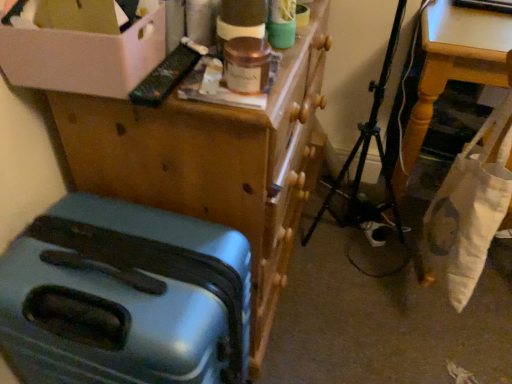
Question: Visually, is white fabric bag at lower right positioned to the left or to the right of metallic blue suitcase at lower left?

Choices:
 (A) right
 (B) left

Answer: (A)

Question: Considering the positions of white fabric bag at lower right and metallic blue suitcase at lower left in the image, is white fabric bag at lower right wider or thinner than metallic blue suitcase at lower left?

Choices:
 (A) wide
 (B) thin

Answer: (B)

Question: Which object is the farthest from the white cardboard box at upper left?

Choices:
 (A) teal plastic suitcase at lower left
 (B) white fabric bag at lower right
 (C) metallic blue suitcase at lower left
 (D) wooden table at lower right

Answer: (B)

Question: Which object is positioned farthest from the metallic blue suitcase at lower left?

Choices:
 (A) teal plastic suitcase at lower left
 (B) wooden table at lower right
 (C) white fabric bag at lower right
 (D) white cardboard box at upper left

Answer: (B)